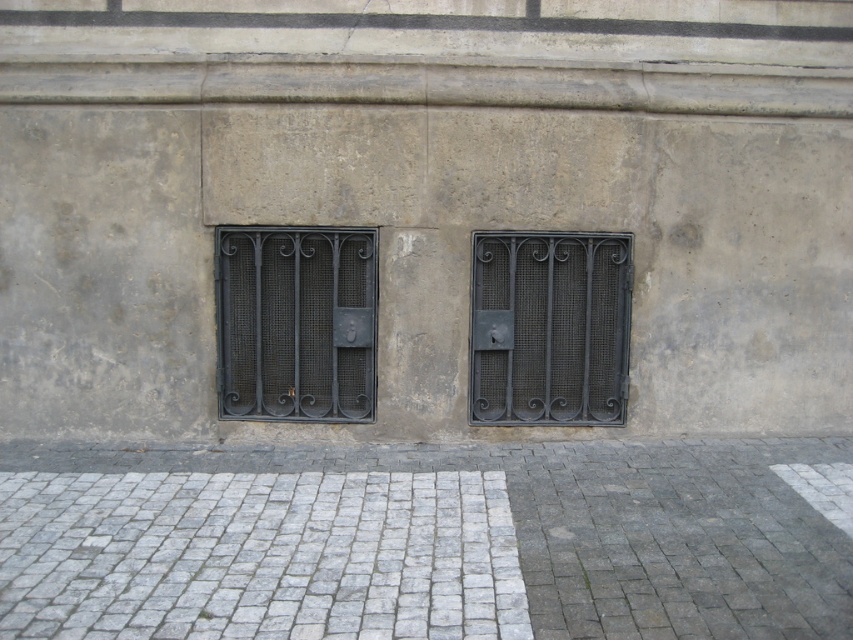
You are standing in front of the stone wall with two metal grates. You need to place a small potted plant on the gray cobblestone pavement at center so that it is visible from the black wrought iron window at center. Is this possible?

The gray cobblestone pavement at center is in front of the black wrought iron window at center, so placing the potted plant there would make it visible through the window.

You are standing in front of the stone wall with two metal grates. You notice two points marked on the wall. The first point is at coordinates point (x=318, y=468) and the second is at point (x=489, y=380). Which point is closer to you?

Point (x=318, y=468) is in front of point (x=489, y=380), so it is closer to you.

You are a delivery person with a box that is 1.2 meters wide. You need to move the box through the space between the gray cobblestone pavement at center and the black wrought iron window at center. Can the box fit through that space?

The space between the gray cobblestone pavement at center and the black wrought iron window at center is 1.15 meters. Since the box is 1.2 meters wide, it cannot fit through the space as it is slightly wider than the available gap.